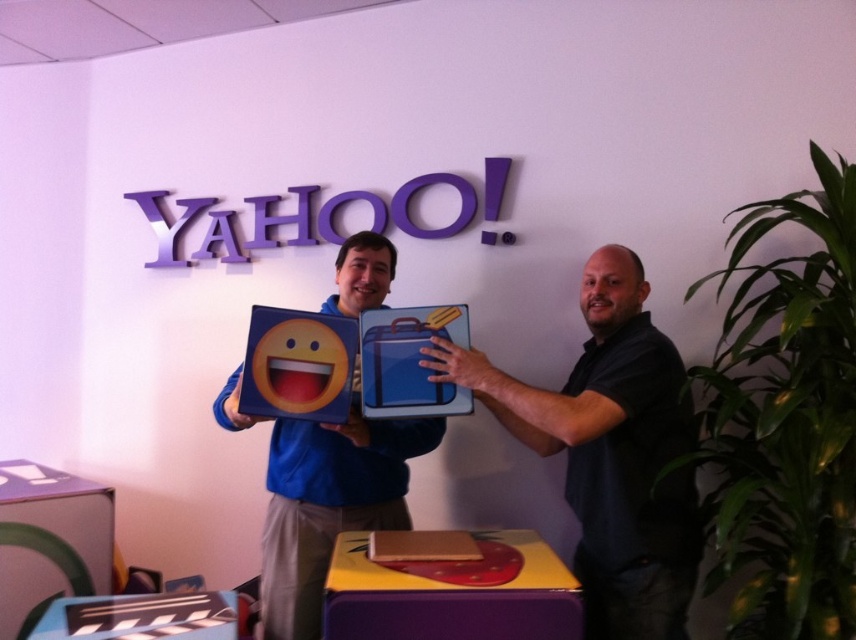
Question: Considering the relative positions of blue matte emoji box at center and matte blue clapperboard at center in the image provided, where is blue matte emoji box at center located with respect to matte blue clapperboard at center?

Choices:
 (A) above
 (B) below

Answer: (A)

Question: Is the position of dark blue shirt at center more distant than that of matte blue clapperboard at center?

Choices:
 (A) yes
 (B) no

Answer: (A)

Question: Among these points, which one is farthest from the camera?

Choices:
 (A) (295, 422)
 (B) (81, 484)

Answer: (B)

Question: Which object is positioned farthest from the matte cardboard box at lower left?

Choices:
 (A) dark blue shirt at center
 (B) blue fabric suitcase at center
 (C) blue matte emoji box at center
 (D) purple matte box at center

Answer: (A)

Question: Which of the following is the closest to the observer?

Choices:
 (A) blue matte emoji box at center
 (B) purple matte box at center
 (C) dark blue shirt at center

Answer: (B)

Question: In this image, where is dark blue shirt at center located relative to matte blue clapperboard at center?

Choices:
 (A) above
 (B) below

Answer: (A)